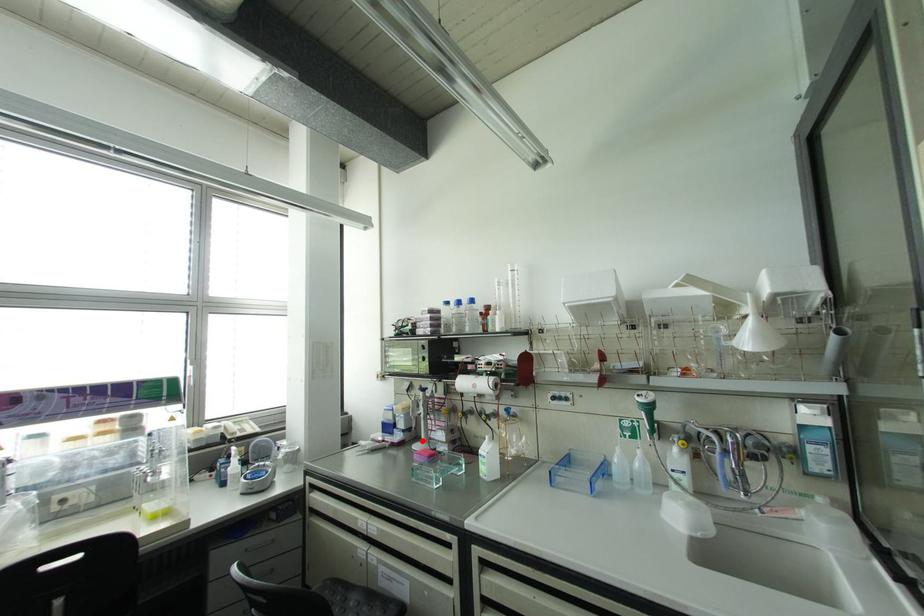
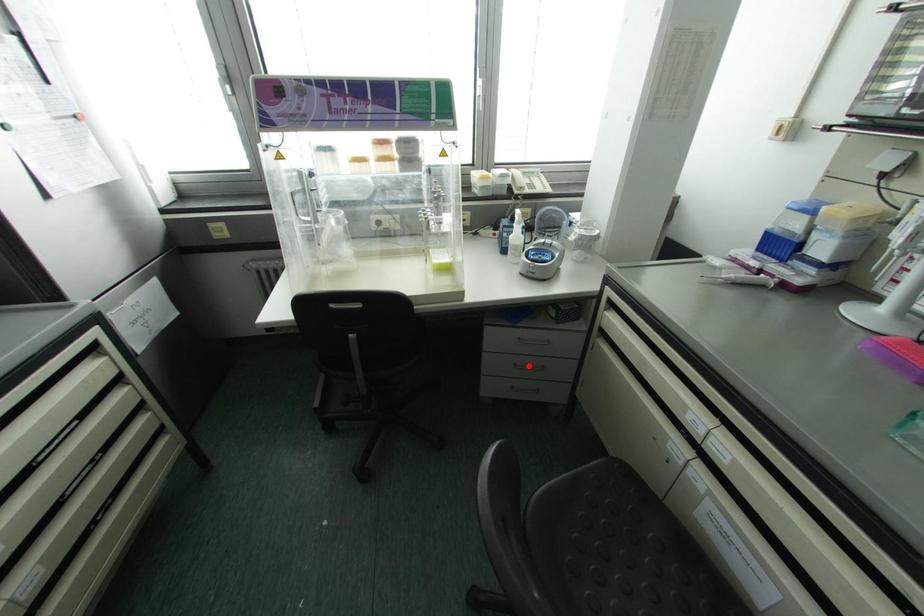
I am providing you with two images of the same scene from different viewpoints. A red point is marked on the first image and another point is marked on the second image. Are the points marked in image1 and image2 representing the same 3D position?

No